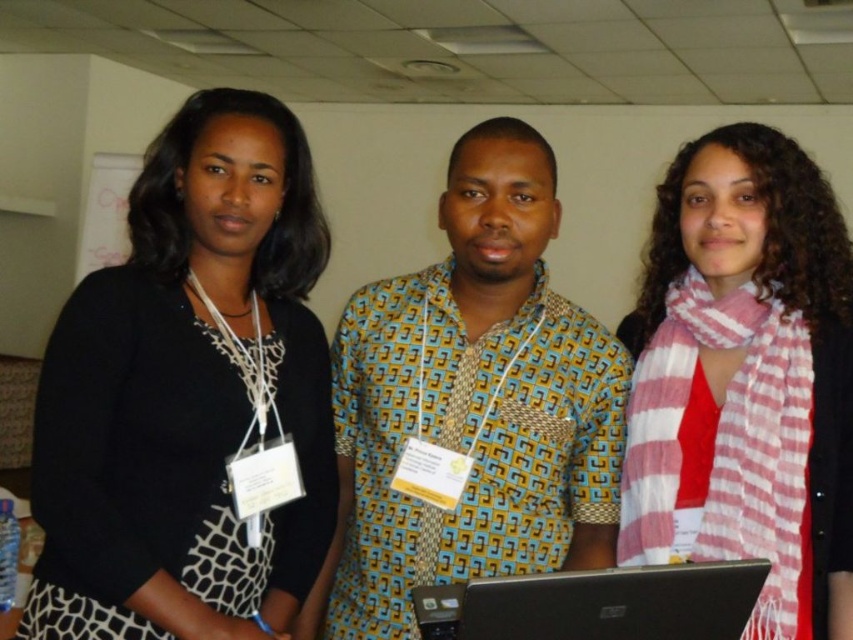
You are organizing a photo shoot and need to ensure that the black matte sweater at left is visible in the frame. Given that the black plastic laptop at center is currently blocking part of the sweater, can you adjust the camera angle so that the sweater is fully visible without moving the laptop?

The black matte sweater at left is taller than the black plastic laptop at center, so adjusting the camera angle slightly upward should allow the sweater to be fully visible without moving the laptop.

You are standing in the room and want to find the black matte sweater at left. Where should you look relative to the whiteboard in the background?

The black matte sweater at left is located at point 0.622 on the x axis and 0.225 on the y axis relative to the whiteboard in the background.